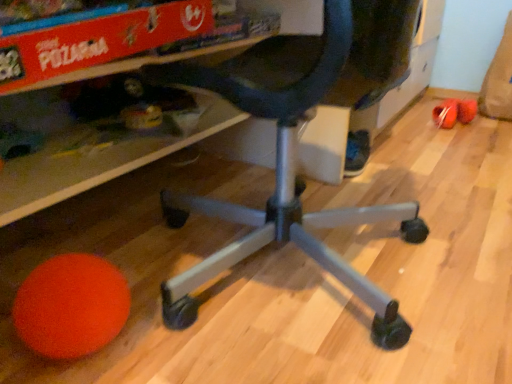
Find the location of a particular element. The image size is (512, 384). orange matte ball at lower left is located at coordinates (71, 306).

What are the coordinates of `black matte office chair at center` in the screenshot? It's located at (296, 144).

Identify the location of ball that appears in front of the rubberized plastic ball at lower left. The height and width of the screenshot is (384, 512). (71, 306).

Can rubberized plastic ball at lower left be found inside orange matte ball at lower left?

No, rubberized plastic ball at lower left is located outside of orange matte ball at lower left.

Is orange matte ball at lower left placed right next to rubberized plastic ball at lower left?

No.

Considering the points (454, 102) and (91, 317), which point is behind, point (454, 102) or point (91, 317)?

The point (454, 102) is behind.

Is rubberized plastic ball at lower left with orange matte ball at lower left?

rubberized plastic ball at lower left and orange matte ball at lower left are not in contact.

Is rubberized plastic ball at lower left further to the viewer compared to black matte office chair at center?

Yes, rubberized plastic ball at lower left is behind black matte office chair at center.

Based on the photo, between rubberized plastic ball at lower left and black matte office chair at center, which one has larger size?

black matte office chair at center.

Is rubberized plastic ball at lower left oriented towards black matte office chair at center?

No, rubberized plastic ball at lower left does not turn towards black matte office chair at center.

Can you tell me how much rubberized plastic ball at lower left and black matte office chair at center differ in facing direction?

There is a 107-degree angle between the facing directions of rubberized plastic ball at lower left and black matte office chair at center.

Does black matte office chair at center come in front of rubberized plastic ball at lower left?

→ That is True.

In the scene shown: Is black matte office chair at center next to rubberized plastic ball at lower left?

No, black matte office chair at center is not making contact with rubberized plastic ball at lower left.

Find the location of a particular element. computer chair on the left of the rubberized plastic ball at lower left is located at coordinates (296, 144).

Which is behind, point (277, 155) or point (40, 322)?

The point (277, 155) is behind.

From the image's perspective, is black matte office chair at center above or below orange matte ball at lower left?

From the image's perspective, black matte office chair at center appears above orange matte ball at lower left.

Is black matte office chair at center closer to the viewer compared to orange matte ball at lower left?

Yes, the depth of black matte office chair at center is less than that of orange matte ball at lower left.

Would you consider black matte office chair at center to be distant from orange matte ball at lower left?

black matte office chair at center is actually quite close to orange matte ball at lower left.

Is orange matte ball at lower left in contact with black matte office chair at center?

No, orange matte ball at lower left is not in contact with black matte office chair at center.

Is orange matte ball at lower left turned away from black matte office chair at center?

That's not correct — orange matte ball at lower left is not looking away from black matte office chair at center.

The height and width of the screenshot is (384, 512). Identify the location of ball on the left of black matte office chair at center. (71, 306).

Between orange matte ball at lower left and black matte office chair at center, which one has smaller width?

orange matte ball at lower left.

This screenshot has width=512, height=384. What are the coordinates of `toy above the orange matte ball at lower left (from the image's perspective)` in the screenshot? It's located at click(446, 113).

Locate an element on the screen. The width and height of the screenshot is (512, 384). ball to the left of rubberized plastic ball at lower left is located at coordinates (71, 306).

Which object lies nearer to the anchor point black matte office chair at center, orange matte ball at lower left or rubberized plastic ball at lower left?

The object closer to black matte office chair at center is orange matte ball at lower left.

Looking at the image, which one is located closer to rubberized plastic ball at lower left, black matte office chair at center or orange matte ball at lower left?

Based on the image, black matte office chair at center appears to be nearer to rubberized plastic ball at lower left.

From the image, which object appears to be farther from orange matte ball at lower left, rubberized plastic ball at lower left or black matte office chair at center?

Among the two, rubberized plastic ball at lower left is located further to orange matte ball at lower left.

When comparing their distances from orange matte ball at lower left, does black matte office chair at center or rubberized plastic ball at lower left seem further?

rubberized plastic ball at lower left.

Based on their spatial positions, is rubberized plastic ball at lower left or orange matte ball at lower left further from black matte office chair at center?

rubberized plastic ball at lower left is further to black matte office chair at center.

From the image, which object appears to be nearer to rubberized plastic ball at lower left, orange matte ball at lower left or black matte office chair at center?

black matte office chair at center lies closer to rubberized plastic ball at lower left than the other object.

Locate an element on the screen. The height and width of the screenshot is (384, 512). ball between black matte office chair at center and rubberized plastic ball at lower left along the z-axis is located at coordinates (71, 306).